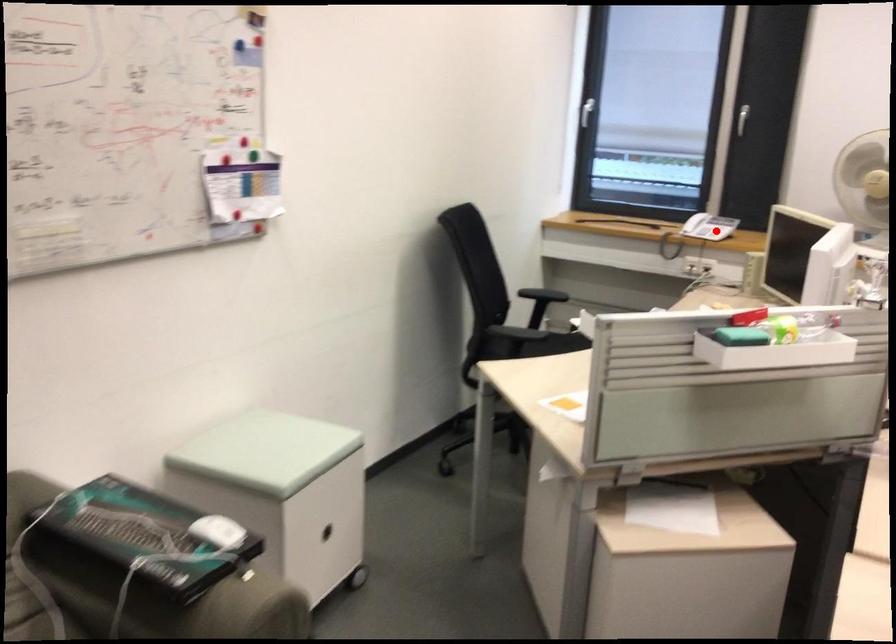
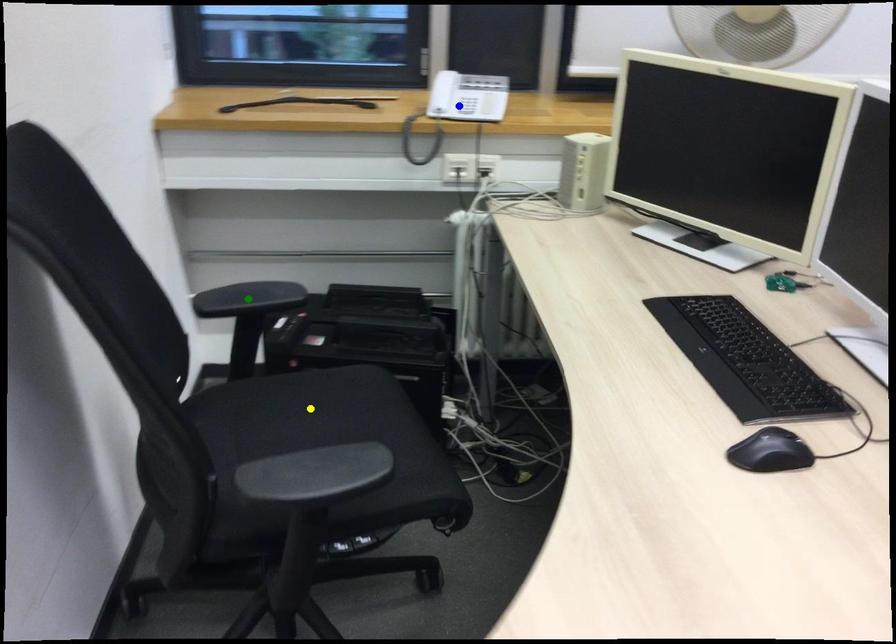
Question: I am providing you with two images of the same scene from different viewpoints. A red point is marked on the first image. You are given multiple points on the second image. In image 2, which mark is for the same physical point as the one in image 1?

Choices:
 (A) green point
 (B) blue point
 (C) yellow point

Answer: (B)